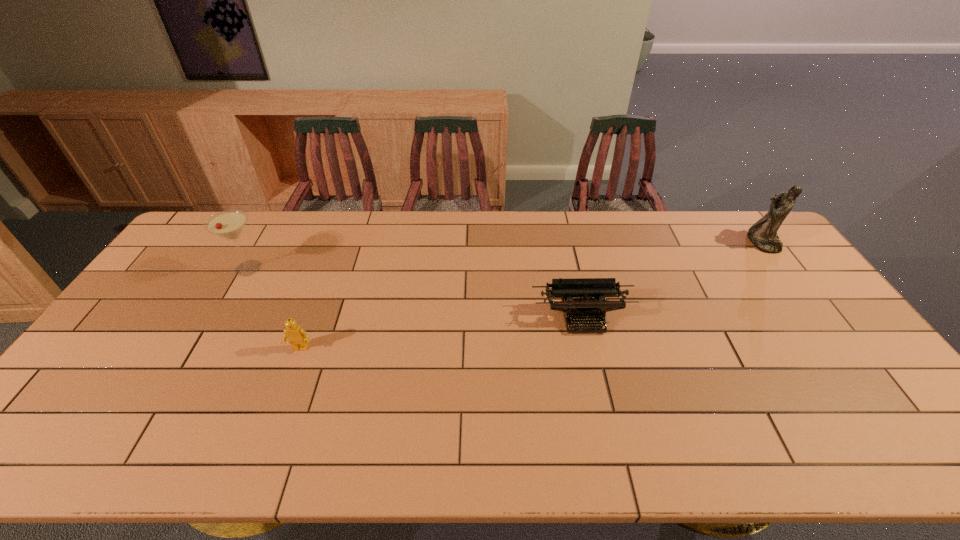
I want to click on the rightmost object, so click(763, 234).

At what (x,y) coordinates should I click in order to perform the action: click on figurine. Please return your answer as a coordinate pair (x, y). Looking at the image, I should click on (763, 234).

The height and width of the screenshot is (540, 960). What are the coordinates of `martini` in the screenshot? It's located at (229, 224).

Image resolution: width=960 pixels, height=540 pixels. I want to click on the second farthest object, so click(229, 224).

Locate an element on the screen. This screenshot has width=960, height=540. Lego is located at coordinates (297, 337).

Where is `the second object from left to right`? the second object from left to right is located at coordinates (297, 337).

At what (x,y) coordinates should I click in order to perform the action: click on the second nearest object. Please return your answer as a coordinate pair (x, y). The width and height of the screenshot is (960, 540). Looking at the image, I should click on (569, 290).

At what (x,y) coordinates should I click in order to perform the action: click on the third object from left to right. Please return your answer as a coordinate pair (x, y). This screenshot has height=540, width=960. Looking at the image, I should click on (569, 290).

The height and width of the screenshot is (540, 960). I want to click on vacant space located 0.120m on the front-facing side of the figurine, so click(x=716, y=242).

Find the location of `free location located on the front-facing side of the figurine`. free location located on the front-facing side of the figurine is located at coordinates (636, 242).